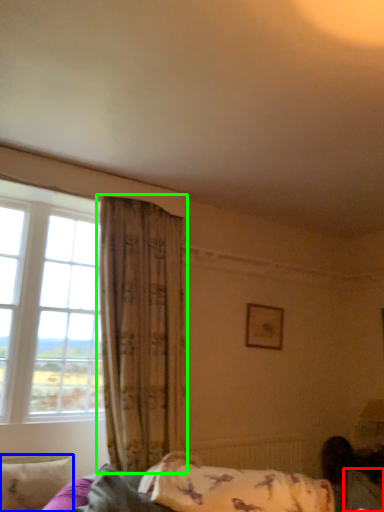
Question: Which is farther away from pillow (highlighted by a red box)? pillow (highlighted by a blue box) or curtain (highlighted by a green box)?

Choices:
 (A) pillow
 (B) curtain

Answer: (A)